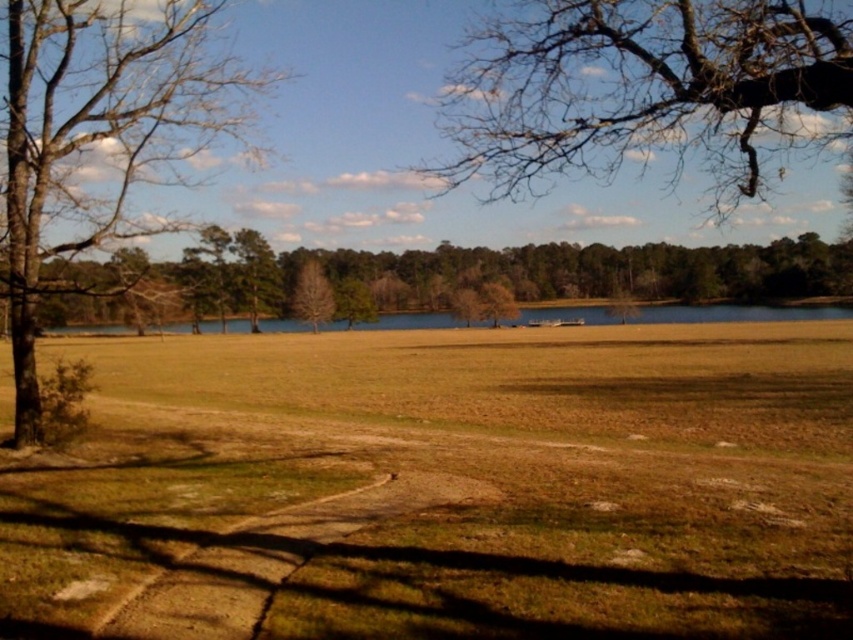
How much distance is there between brown dry grass at center and brown leafless tree at center?

brown dry grass at center is 21.98 meters away from brown leafless tree at center.

Is brown dry grass at center thinner than brown leafless tree at center?

Yes, brown dry grass at center is thinner than brown leafless tree at center.

Who is more distant from viewer, (161, 612) or (643, 273)?

Positioned behind is point (643, 273).

You are a GUI agent. You are given a task and a screenshot of the screen. Output one action in this format:
    pyautogui.click(x=<x>, y=<y>)
    Task: Click on the brown dry grass at center
    This screenshot has height=640, width=853.
    Given the screenshot: What is the action you would take?
    pyautogui.click(x=444, y=486)

Is bare branches at upper center thinner than brown leafless tree at center?

Correct, bare branches at upper center's width is less than brown leafless tree at center's.

Locate an element on the screen. bare branches at upper center is located at coordinates (648, 90).

Is brown dry grass at center further to the viewer compared to bare branches at upper center?

No, brown dry grass at center is in front of bare branches at upper center.

Find the location of a particular element. This screenshot has height=640, width=853. brown dry grass at center is located at coordinates (444, 486).